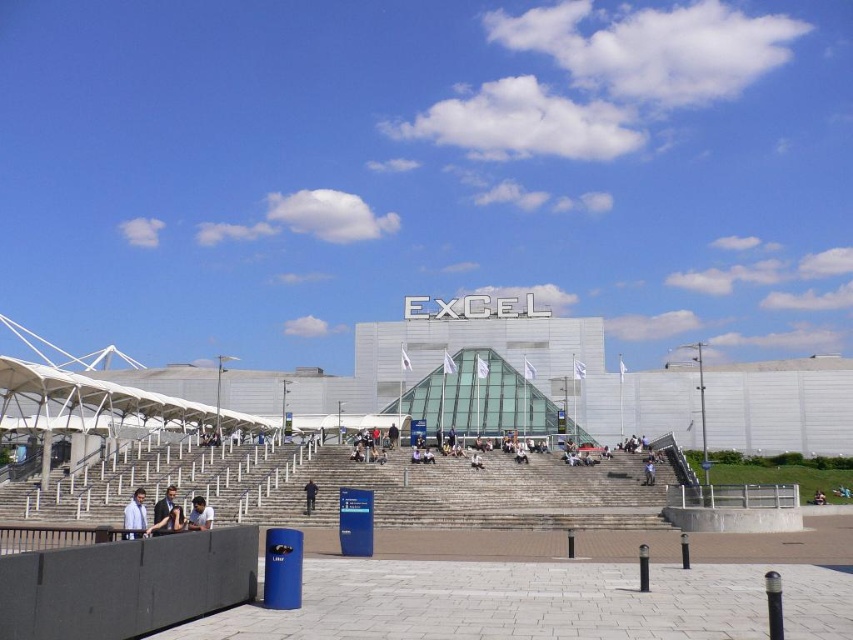
Question: Can you confirm if gray concrete stairs at center is positioned to the left of white shirt at center?

Choices:
 (A) yes
 (B) no

Answer: (B)

Question: Does dark blue fabric at center appear under blue fabric person at center?

Choices:
 (A) no
 (B) yes

Answer: (A)

Question: Which object is farther from the camera taking this photo?

Choices:
 (A) white shirt at center
 (B) white glass building at center
 (C) light blue shirt at lower left
 (D) dark blue shirt at center

Answer: (B)

Question: Which object is the closest to the white glass building at center?

Choices:
 (A) white shirt at center
 (B) dark blue fabric at center
 (C) dark blue jeans at center

Answer: (C)

Question: Which point is closer to the camera taking this photo?

Choices:
 (A) (308, 484)
 (B) (646, 483)

Answer: (A)

Question: In this image, where is gray concrete stairs at center located relative to dark blue jeans at center?

Choices:
 (A) right
 (B) left

Answer: (B)